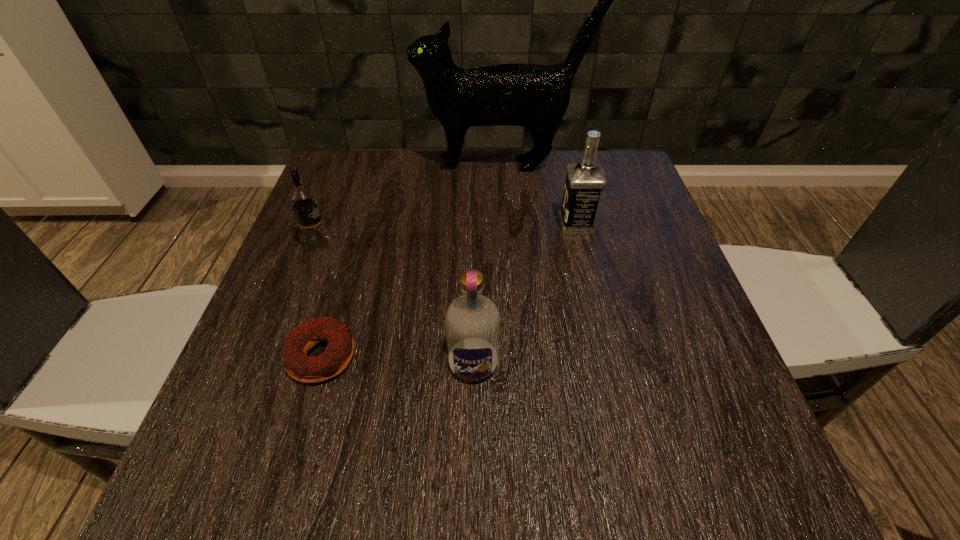
The width and height of the screenshot is (960, 540). What are the coordinates of `the farthest object` in the screenshot? It's located at (536, 97).

Where is `cat`? The image size is (960, 540). cat is located at coordinates (536, 97).

Find the location of a particular element. The height and width of the screenshot is (540, 960). the rightmost vodka is located at coordinates (585, 181).

The height and width of the screenshot is (540, 960). I want to click on the farthest vodka, so click(585, 181).

Identify the location of the nearest vodka. This screenshot has height=540, width=960. (472, 320).

The width and height of the screenshot is (960, 540). Find the location of `the third farthest object`. the third farthest object is located at coordinates (303, 201).

In order to click on the second nearest vodka in this screenshot , I will do coord(303,201).

Locate an element on the screen. The height and width of the screenshot is (540, 960). doughnut is located at coordinates pyautogui.click(x=339, y=352).

The image size is (960, 540). What are the coordinates of `free space located on the face of the cat` in the screenshot? It's located at (342, 165).

Image resolution: width=960 pixels, height=540 pixels. What are the coordinates of `vacant space situated 0.100m on the face of the cat` in the screenshot? It's located at (380, 165).